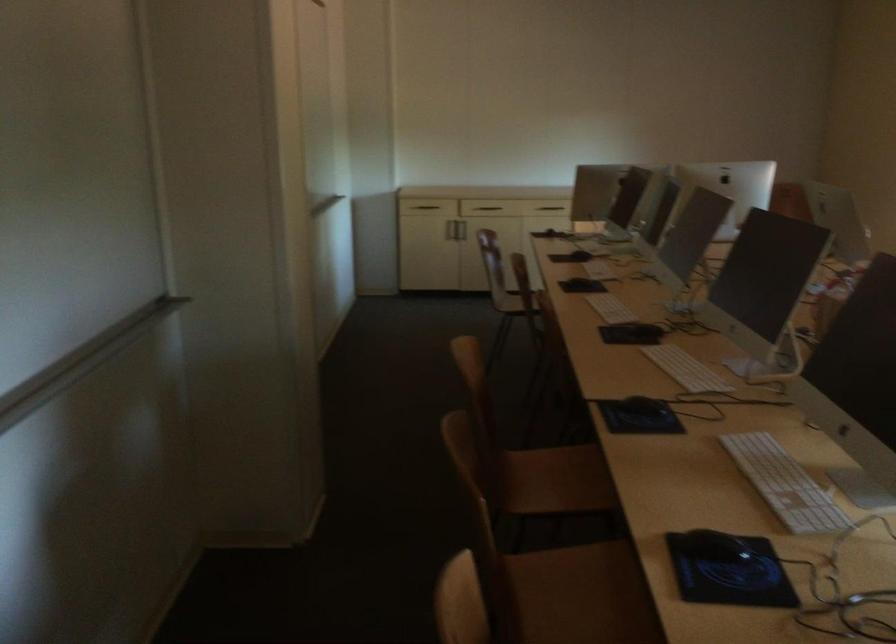
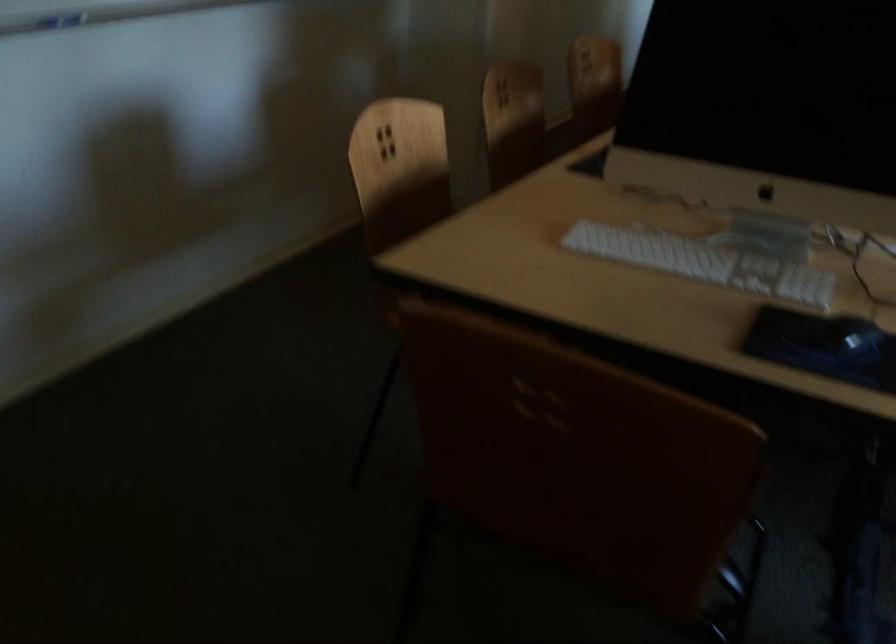
Question: I am providing you with two images of the same scene from different viewpoints. Please identify which objects are invisible in image2.

Choices:
 (A) white keyboard
 (B) red cabinet button
 (C) white computer keyboard
 (D) black computer mouse

Answer: (C)